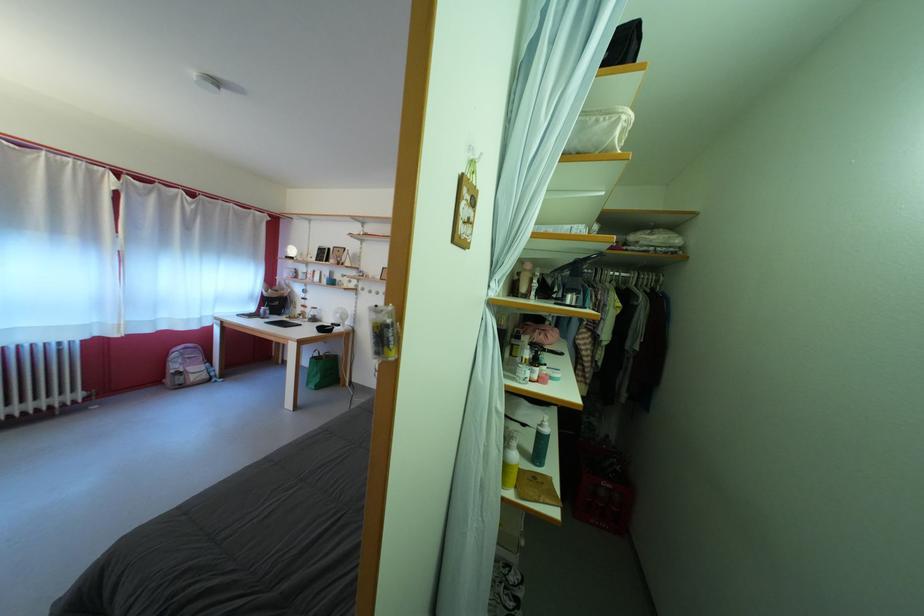
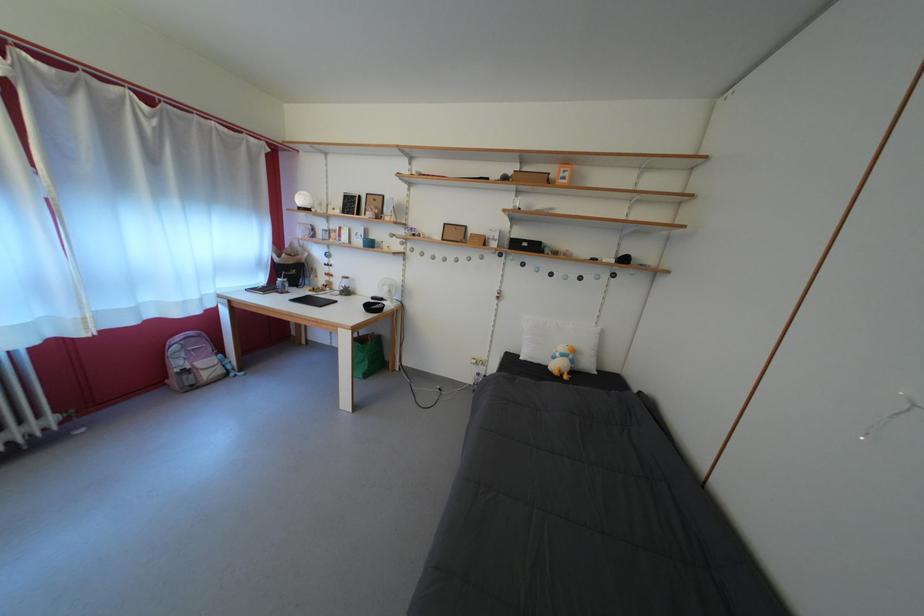
In a continuous first-person perspective shot, in which direction is the camera moving?

The movement direction of the cameraman is left, forward.